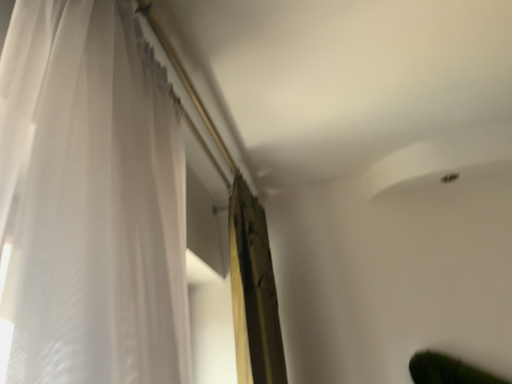
This screenshot has height=384, width=512. I want to click on white sheer curtain at left, so click(92, 199).

The image size is (512, 384). What do you see at coordinates (92, 199) in the screenshot?
I see `white sheer curtain at left` at bounding box center [92, 199].

Where is `white sheer curtain at left`? This screenshot has width=512, height=384. white sheer curtain at left is located at coordinates (92, 199).